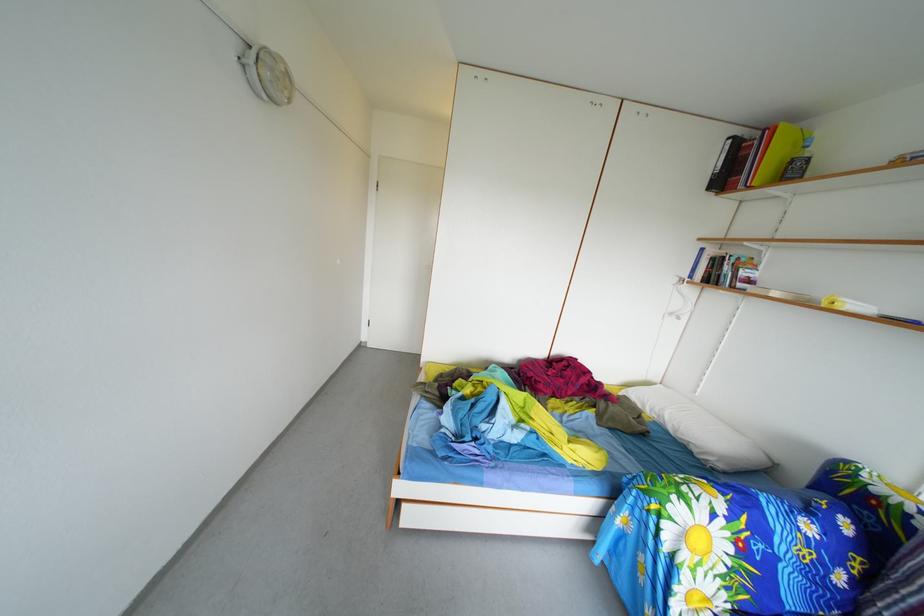
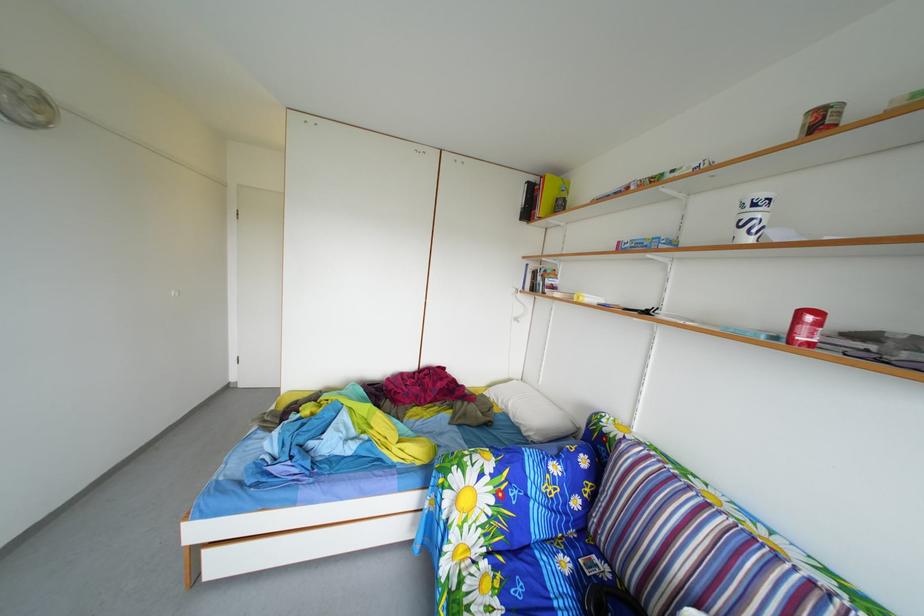
Locate, in the second image, the point that corresponds to pixel 277 82 in the first image.

(14, 105)